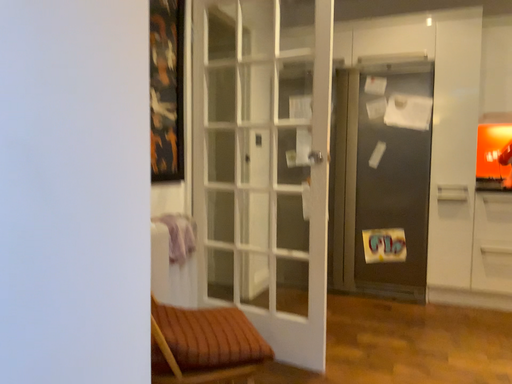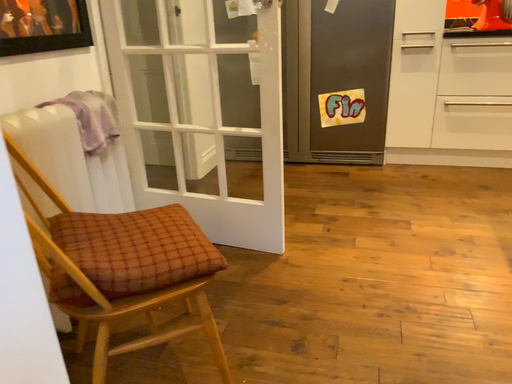
Question: How did the camera likely rotate when shooting the video?

Choices:
 (A) rotated downward
 (B) rotated upward

Answer: (A)